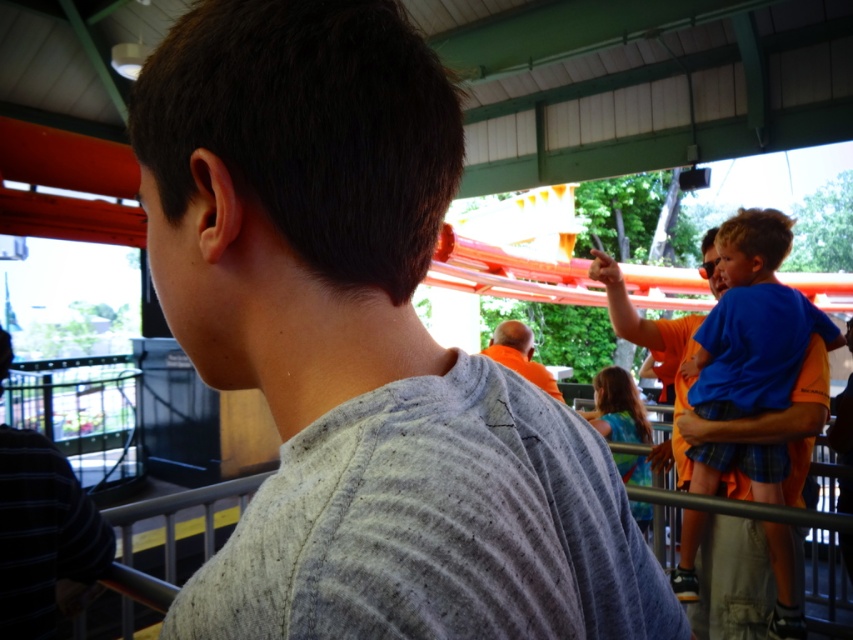
How much distance is there between blue denim shirt at center and orange cotton shirt at center?

blue denim shirt at center and orange cotton shirt at center are 16.44 inches apart.

Is point (643, 524) closer to camera compared to point (503, 332)?

No.

Find the location of a particular element. The height and width of the screenshot is (640, 853). blue denim shirt at center is located at coordinates (618, 406).

Does blue cotton shirt at right appear under orange cotton shirt at center?

Yes.

Can you confirm if blue cotton shirt at right is wider than orange cotton shirt at center?

Indeed, blue cotton shirt at right has a greater width compared to orange cotton shirt at center.

Which is behind, point (764, 336) or point (490, 339)?

The point (490, 339) is more distant.

This screenshot has height=640, width=853. I want to click on blue cotton shirt at right, so tap(752, 324).

Between gray cotton shirt at center and striped cotton shirt at left, which one has more height?

With more height is striped cotton shirt at left.

What are the coordinates of `gray cotton shirt at center` in the screenshot? It's located at (361, 349).

Locate an element on the screen. The image size is (853, 640). gray cotton shirt at center is located at coordinates (361, 349).